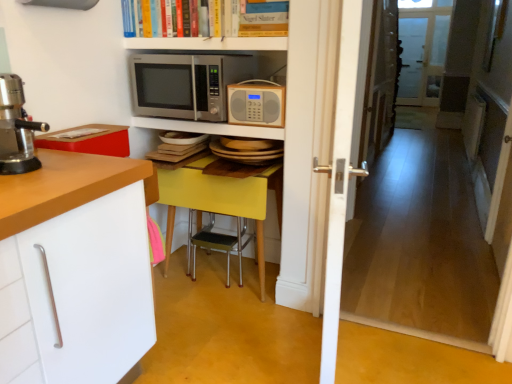
Identify the location of vacant space in front of yellow matte table at center. (221, 328).